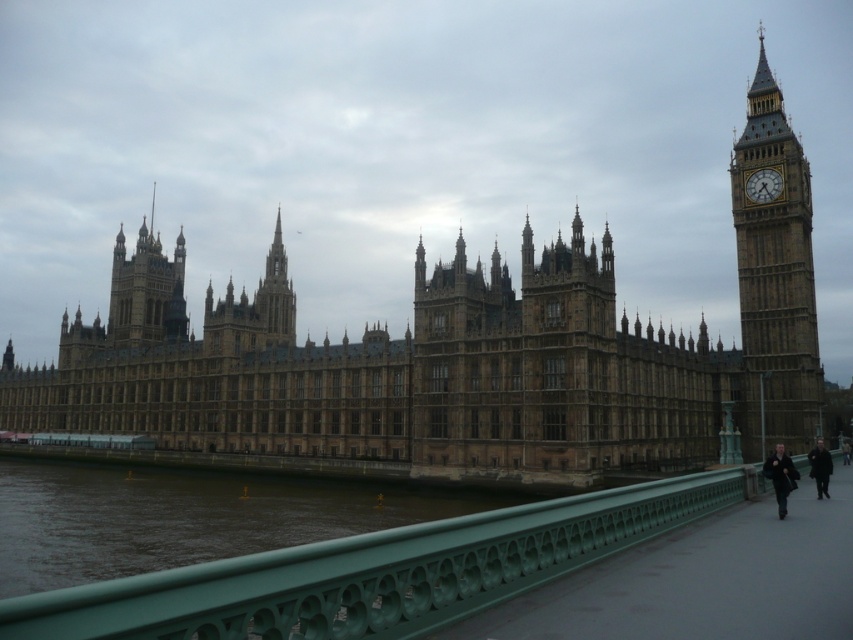
Question: Which point is farther to the camera?

Choices:
 (A) (471, 433)
 (B) (816, 490)
 (C) (730, 195)

Answer: (C)

Question: Among these objects, which one is farthest from the camera?

Choices:
 (A) dark brown leather jacket at lower right
 (B) dark brown coat at lower right
 (C) dark blue jacket at lower right

Answer: (A)

Question: Which object is closer to the camera taking this photo?

Choices:
 (A) green metal railing at lower center
 (B) gold stone clock at upper right

Answer: (A)

Question: Can you confirm if brown stone clock tower at right is positioned to the left of gold stone clock at upper right?

Choices:
 (A) no
 (B) yes

Answer: (A)

Question: In this image, where is brown stone clock tower at right located relative to dark brown leather jacket at lower right?

Choices:
 (A) right
 (B) left

Answer: (B)

Question: Does brown stone castle at center have a lesser width compared to green metal railing at lower center?

Choices:
 (A) no
 (B) yes

Answer: (A)